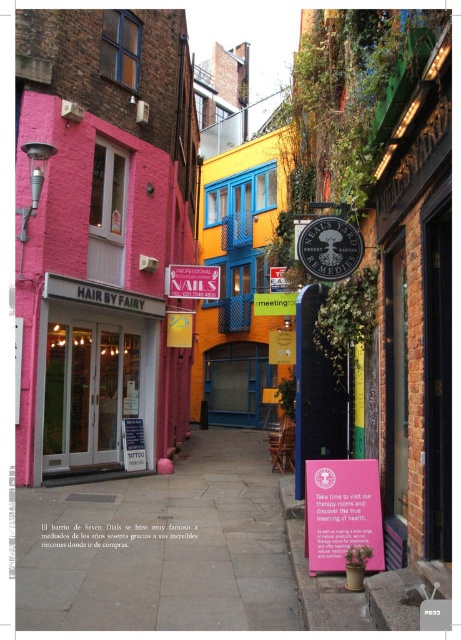
Is point (199, 508) closer to viewer compared to point (54, 316)?

That is True.

Is smooth concrete pavement at center thinner than matte white door at center?

No.

This screenshot has height=640, width=461. I want to click on smooth concrete pavement at center, so click(x=160, y=547).

This screenshot has width=461, height=640. What are the coordinates of `smooth concrete pavement at center` in the screenshot? It's located at (160, 547).

Does point (76, 307) lie in front of point (198, 266)?

That is True.

Between point (114, 337) and point (175, 272), which one is positioned in front?

Point (114, 337)

Where is `matte white door at center`? matte white door at center is located at coordinates (94, 372).

Who is positioned more to the right, pink paper sign at center or metallic silver sign at center?

pink paper sign at center

Who is positioned more to the left, pink paper sign at center or metallic silver sign at center?

From the viewer's perspective, metallic silver sign at center appears more on the left side.

Describe the element at coordinates (342, 513) in the screenshot. I see `pink paper sign at center` at that location.

Find the location of a particular element. The width and height of the screenshot is (461, 640). pink paper sign at center is located at coordinates (342, 513).